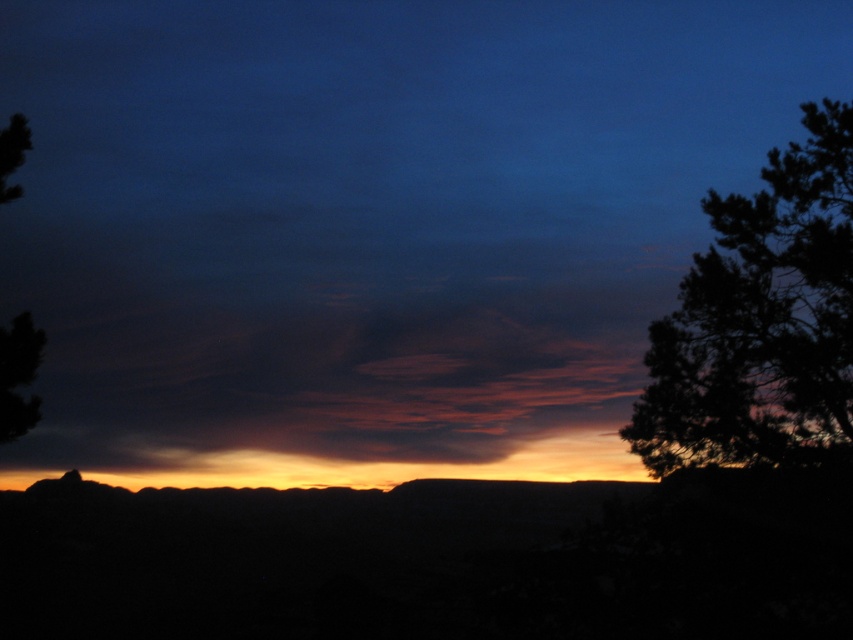
You are an observer standing at the center of the landscape looking towards the sunset. Which tree, the dark green textured tree at right or the dark green leafy tree at left, appears closer to you?

The dark green textured tree at right appears closer to you because it is positioned further to the viewer compared to the dark green leafy tree at left.